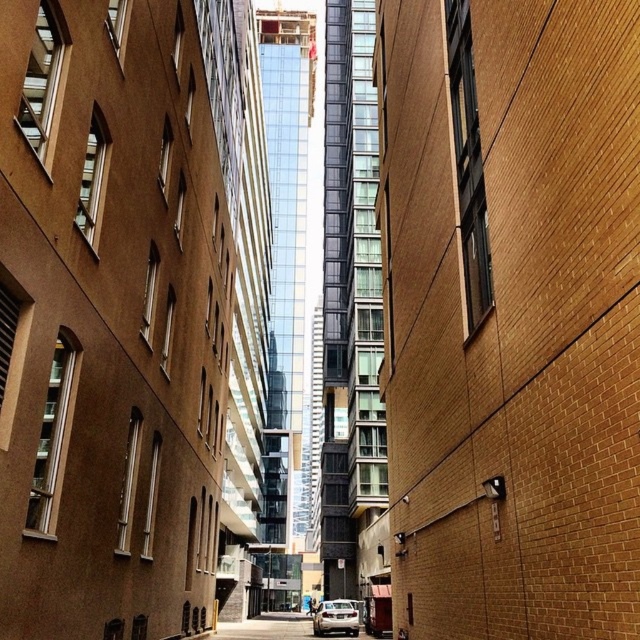
Measure the distance from brown brick wall at center to silver metallic car at lower center.

12.93 meters

Can you confirm if brown brick wall at center is wider than silver metallic car at lower center?

No, brown brick wall at center is not wider than silver metallic car at lower center.

Describe the element at coordinates (512, 314) in the screenshot. I see `brown brick wall at center` at that location.

At what (x,y) coordinates should I click in order to perform the action: click on brown brick wall at center. Please return your answer as a coordinate pair (x, y). This screenshot has height=640, width=640. Looking at the image, I should click on (512, 314).